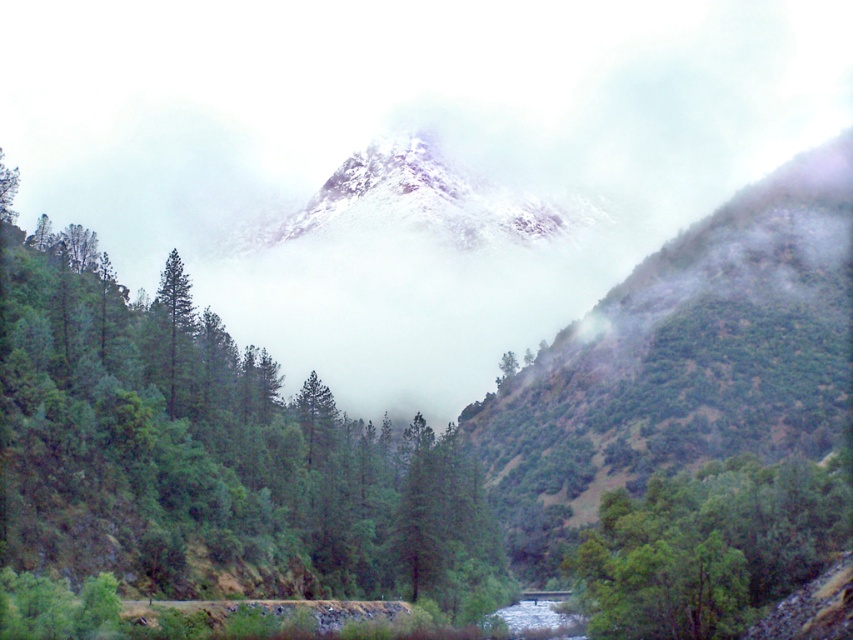
Question: Which of these objects is positioned closest to the green matte tree at left?

Choices:
 (A) green matte tree at center
 (B) green leafy tree at lower right

Answer: (A)

Question: Does green leafy tree at lower right have a greater width compared to green matte tree at left?

Choices:
 (A) yes
 (B) no

Answer: (A)

Question: Does green matte tree at center appear under green leafy tree at lower right?

Choices:
 (A) no
 (B) yes

Answer: (A)

Question: Which object is positioned closest to the green matte tree at left?

Choices:
 (A) green matte tree at center
 (B) green leafy tree at lower right

Answer: (A)

Question: Does green matte tree at center appear on the left side of green matte tree at left?

Choices:
 (A) yes
 (B) no

Answer: (B)

Question: Which object is farther from the camera taking this photo?

Choices:
 (A) green matte tree at center
 (B) green leafy tree at lower right
 (C) green matte tree at left

Answer: (C)